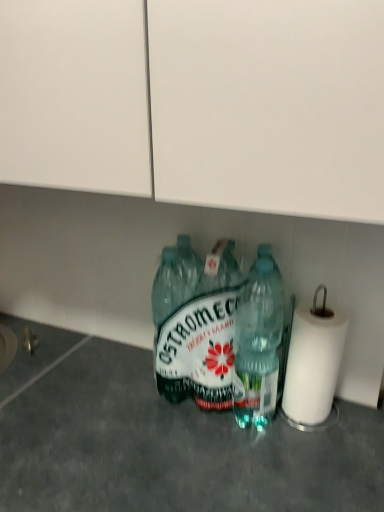
Locate an element on the screen. unoccupied region to the right of white paper at right is located at coordinates (359, 414).